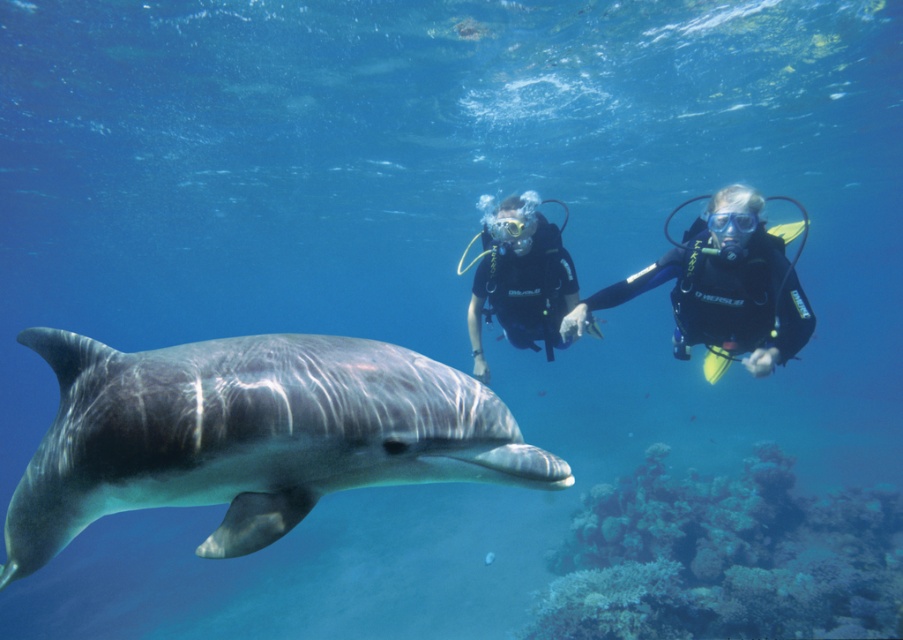
Is point (413, 355) positioned in front of point (526, 230)?

Yes, it is.

Who is taller, gray smooth dolphin at center or black scuba diver at center?

With more height is black scuba diver at center.

Does point (401, 352) come closer to viewer compared to point (487, 282)?

Yes, point (401, 352) is in front of point (487, 282).

Image resolution: width=903 pixels, height=640 pixels. I want to click on gray smooth dolphin at center, so click(250, 435).

Is gray smooth dolphin at center behind white coral at lower right?

That is False.

Identify the location of gray smooth dolphin at center. The height and width of the screenshot is (640, 903). (250, 435).

Which of these two, white coral at lower right or black rubber scuba divers at center, stands shorter?

white coral at lower right is shorter.

Is point (830, 605) positioned in front of point (751, 314)?

That is False.

Is point (870, 564) positioned before point (717, 248)?

No, it is behind (717, 248).

Where is `white coral at lower right`? The image size is (903, 640). white coral at lower right is located at coordinates (723, 557).